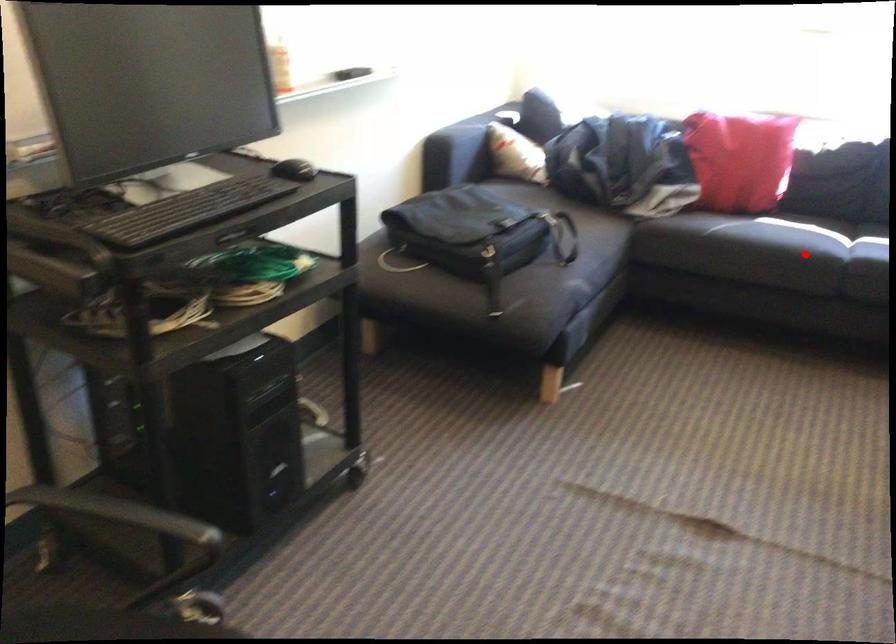
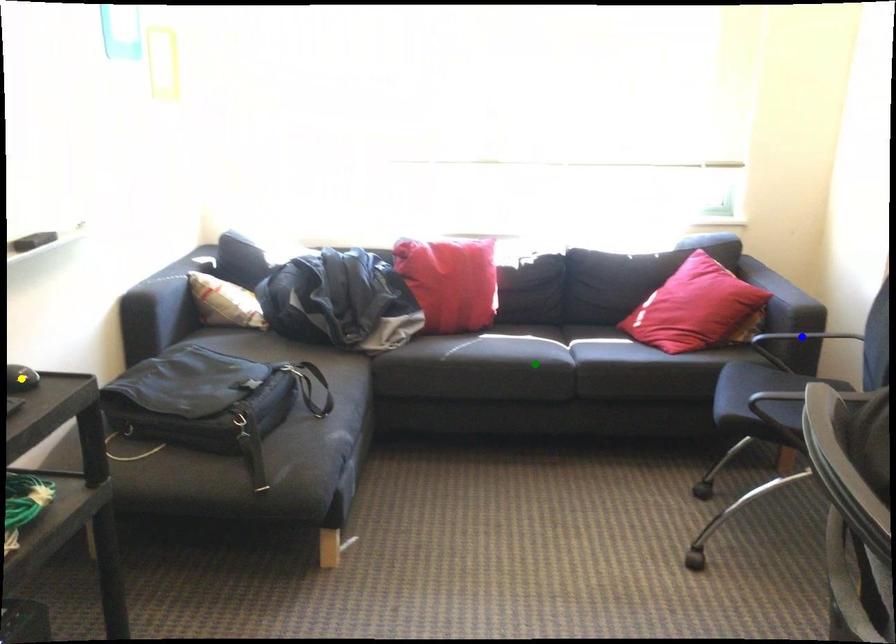
Question: I am providing you with two images of the same scene from different viewpoints. A red point is marked on the first image. You are given multiple points on the second image. Which point in image 2 represents the same 3d spot as the red point in image 1?

Choices:
 (A) blue point
 (B) green point
 (C) yellow point

Answer: (B)